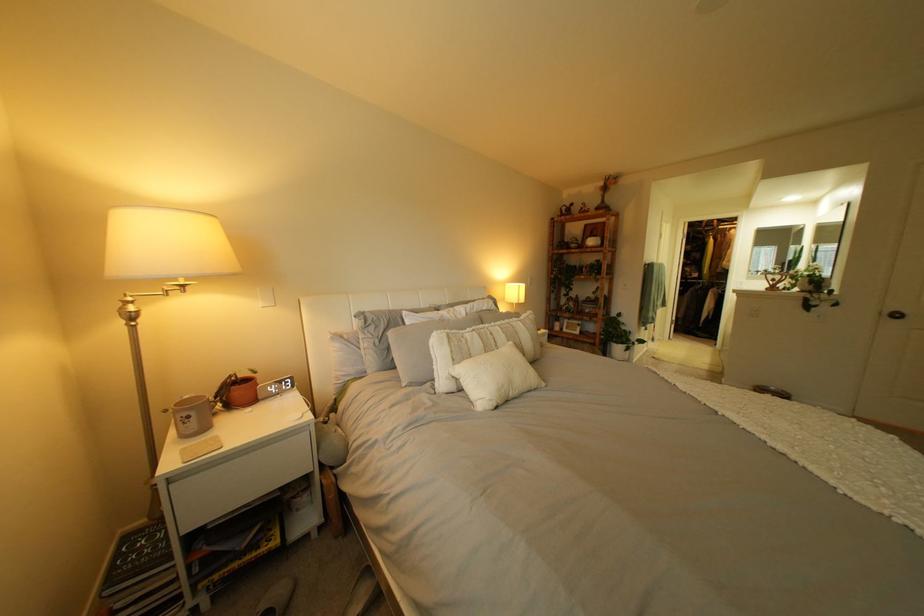
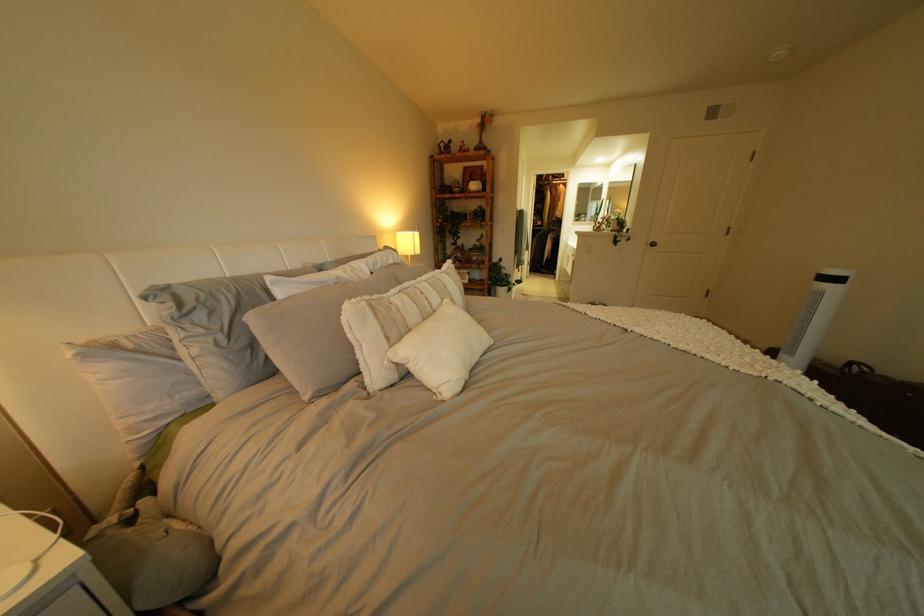
Question: How did the camera likely rotate?

Choices:
 (A) Left
 (B) Right
 (C) Up
 (D) Down

Answer: (B)